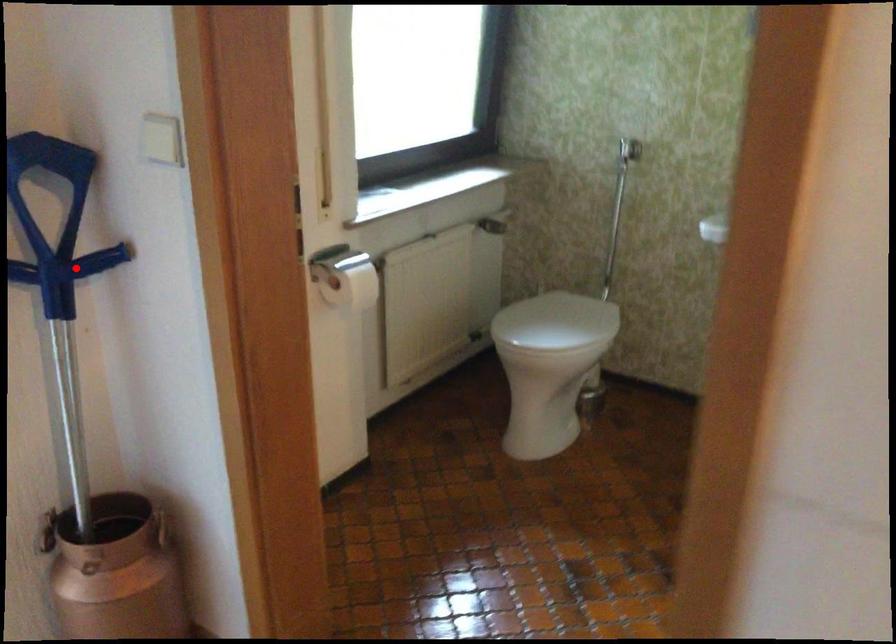
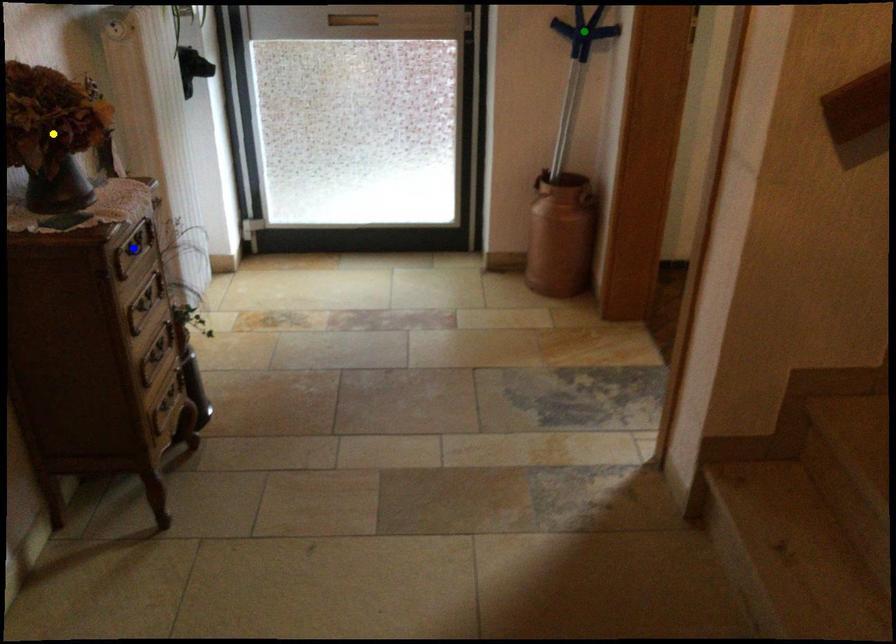
Question: I am providing you with two images of the same scene from different viewpoints. A red point is marked on the first image. You are given multiple points on the second image. Can you choose the point in image 2 that corresponds to the point in image 1?

Choices:
 (A) blue point
 (B) green point
 (C) yellow point

Answer: (B)